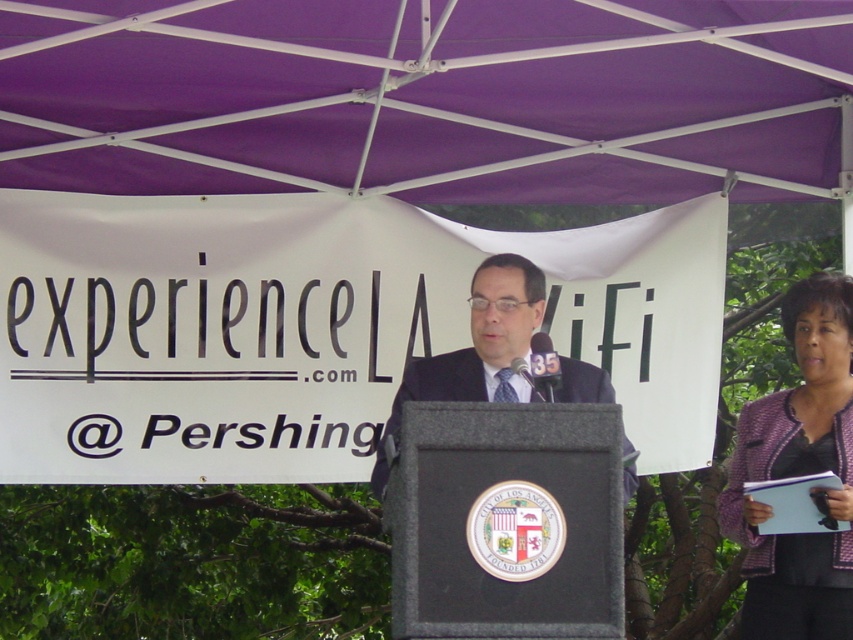
Between purple fabric canopy at upper center and purple tweed blazer at lower right, which one appears on the left side from the viewer's perspective?

From the viewer's perspective, purple fabric canopy at upper center appears more on the left side.

The height and width of the screenshot is (640, 853). What do you see at coordinates (424, 97) in the screenshot?
I see `purple fabric canopy at upper center` at bounding box center [424, 97].

This screenshot has width=853, height=640. Identify the location of purple fabric canopy at upper center. (424, 97).

Identify the location of purple fabric canopy at upper center. This screenshot has width=853, height=640. (424, 97).

The image size is (853, 640). Describe the element at coordinates (424, 97) in the screenshot. I see `purple fabric canopy at upper center` at that location.

Is point (4, 100) positioned after point (515, 376)?

Yes, point (4, 100) is farther from viewer.

Which is behind, point (354, 12) or point (523, 282)?

The point (523, 282) is behind.

Locate an element on the screen. This screenshot has width=853, height=640. purple fabric canopy at upper center is located at coordinates (424, 97).

Which is more to the right, purple tweed blazer at lower right or dark blue suit at center?

purple tweed blazer at lower right is more to the right.

Between purple tweed blazer at lower right and dark blue suit at center, which one is positioned lower?

purple tweed blazer at lower right is below.

The width and height of the screenshot is (853, 640). Identify the location of purple tweed blazer at lower right. (799, 474).

This screenshot has height=640, width=853. In order to click on purple tweed blazer at lower right in this screenshot , I will do `click(799, 474)`.